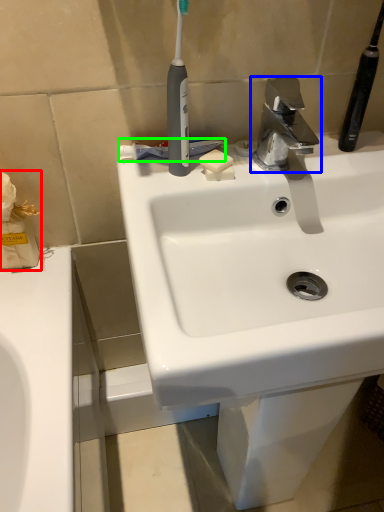
Question: Based on their relative distances, which object is nearer to tissue (highlighted by a red box)? Choose from tap (highlighted by a blue box) and toothpaste (highlighted by a green box).

Choices:
 (A) tap
 (B) toothpaste

Answer: (B)